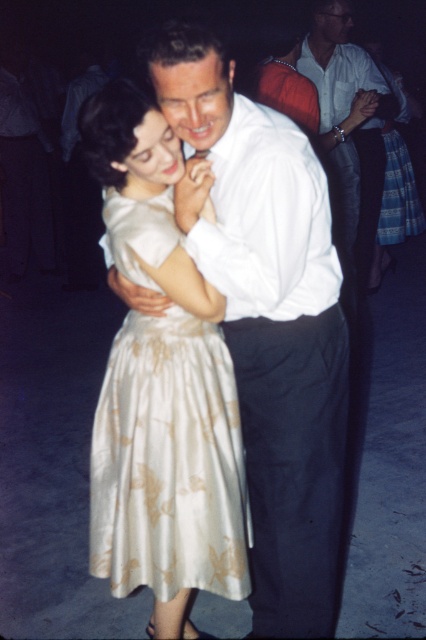
Who is taller, white satin dress at center or white smooth shirt at upper center?

white smooth shirt at upper center is taller.

Between white satin dress at center and white smooth shirt at upper center, which one appears on the right side from the viewer's perspective?

white smooth shirt at upper center

Describe the element at coordinates (169, 461) in the screenshot. The image size is (426, 640). I see `white satin dress at center` at that location.

You are a GUI agent. You are given a task and a screenshot of the screen. Output one action in this format:
    pyautogui.click(x=<x>, y=<y>)
    Task: Click on the white satin dress at center
    The height and width of the screenshot is (640, 426).
    Given the screenshot: What is the action you would take?
    pyautogui.click(x=169, y=461)